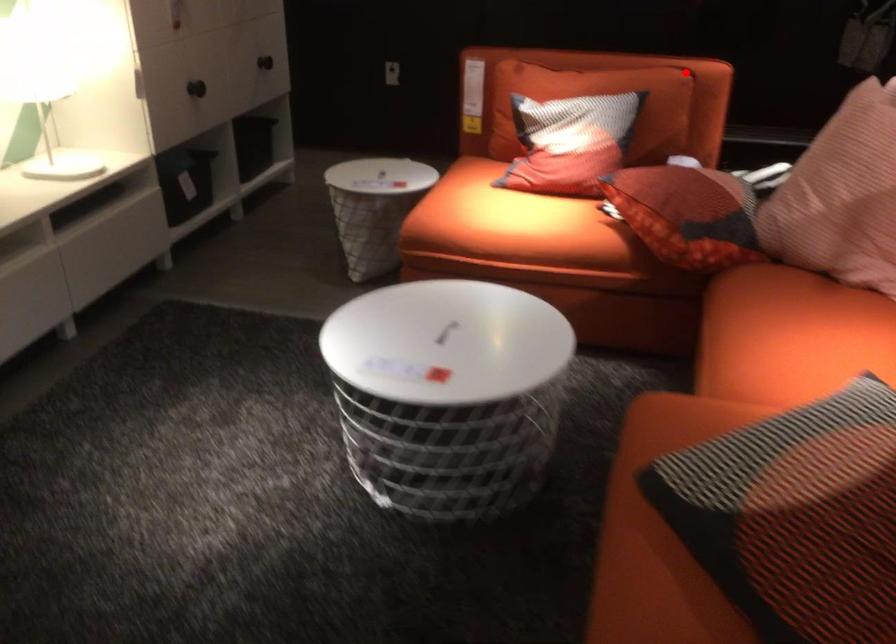
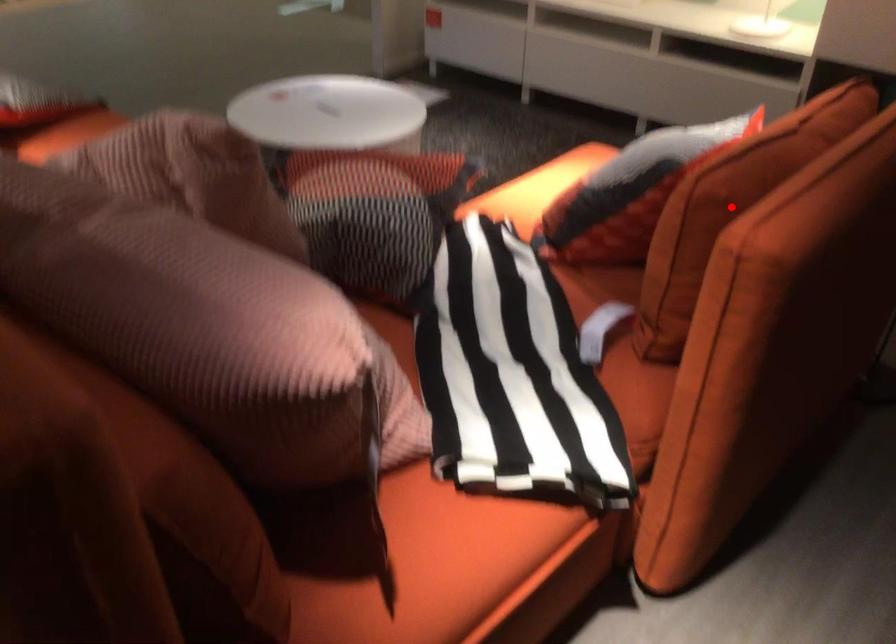
I am providing you with two images of the same scene from different viewpoints. A red point is marked on the first image and another point is marked on the second image. Are the points marked in image1 and image2 representing the same 3D position?

Yes